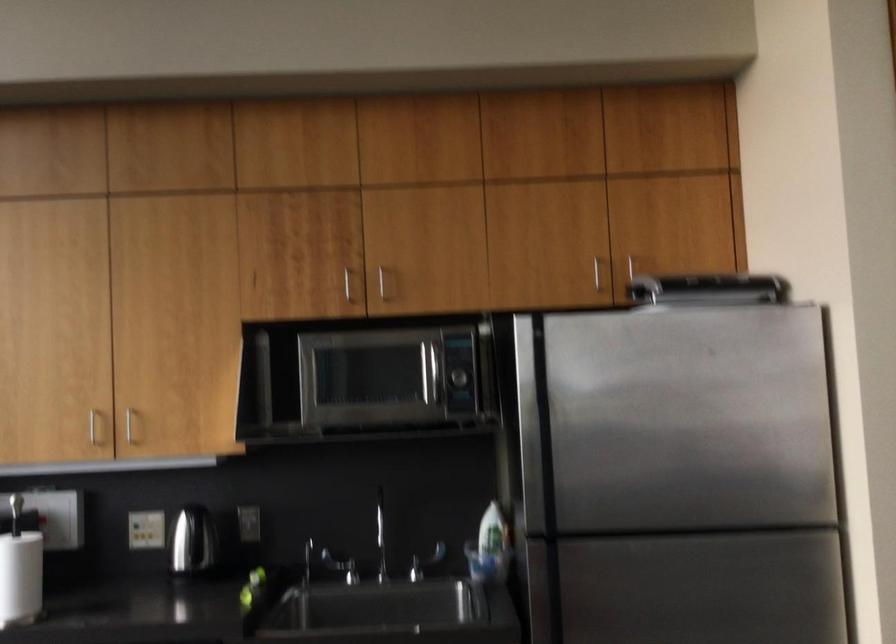
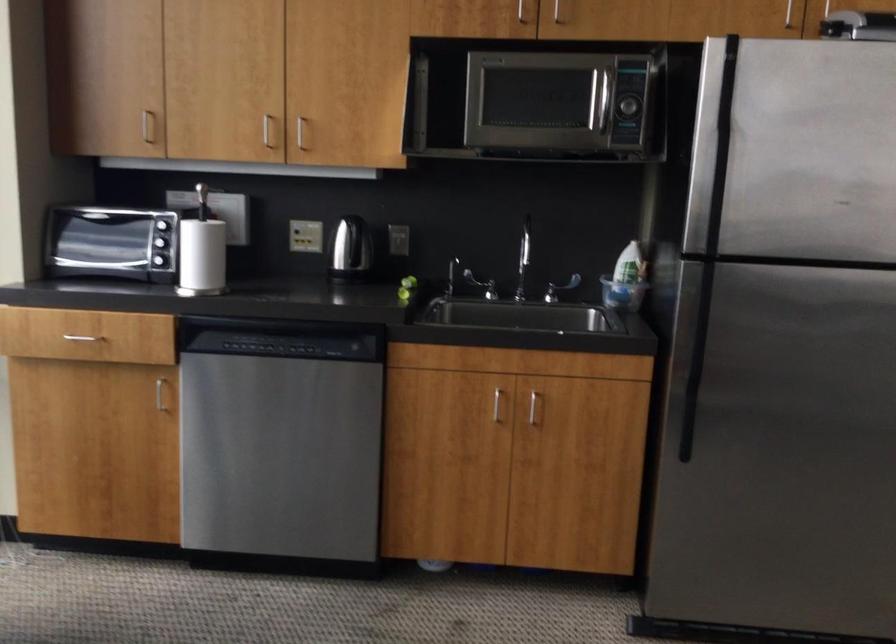
Locate, in the second image, the point that corresponds to the point at 92,427 in the first image.

(266, 129)